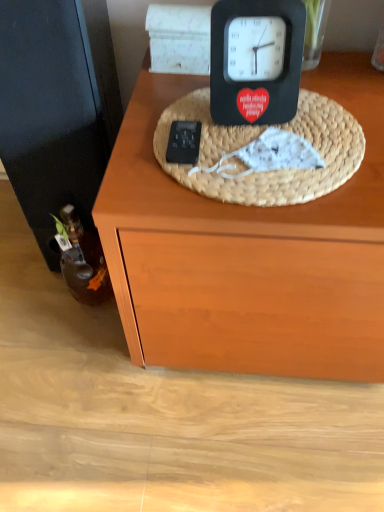
Question: Looking at their shapes, would you say brown glass bottle at left is wider or thinner than black matte clock at upper center?

Choices:
 (A) thin
 (B) wide

Answer: (A)

Question: Considering the positions of brown glass bottle at left and black matte clock at upper center in the image, is brown glass bottle at left taller or shorter than black matte clock at upper center?

Choices:
 (A) short
 (B) tall

Answer: (B)

Question: Which is farther from the woven straw basket at center?

Choices:
 (A) brown glass bottle at left
 (B) black matte clock at upper center

Answer: (A)

Question: Which object is positioned farthest from the brown glass bottle at left?

Choices:
 (A) black matte clock at upper center
 (B) woven straw basket at center

Answer: (A)